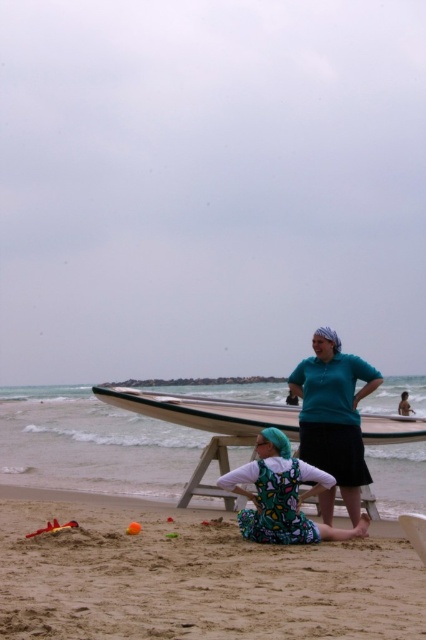
Does point (270, 516) come farther from viewer compared to point (195, 474)?

No, (270, 516) is in front of (195, 474).

Does point (259, 502) come in front of point (206, 468)?

Yes, point (259, 502) is closer to viewer.

Does point (281, 436) come behind point (230, 509)?

No, (281, 436) is in front of (230, 509).

In order to click on printed fabric swimsuit at center in this screenshot , I will do `click(282, 496)`.

Between fine-grained sand at lower center and wooden picnic table at center, which one has less height?

With less height is fine-grained sand at lower center.

This screenshot has width=426, height=640. Identify the location of fine-grained sand at lower center. (192, 577).

Between point (334, 348) and point (397, 424), which one is positioned behind?

Positioned behind is point (397, 424).

Which is in front, point (316, 400) or point (204, 410)?

Point (316, 400) is in front.

Is point (325, 420) more distant than point (287, 404)?

That is False.

At what (x,y) coordinates should I click in order to perform the action: click on teal matte shirt at center. Please return your answer as a coordinate pair (x, y). Looking at the image, I should click on (333, 413).